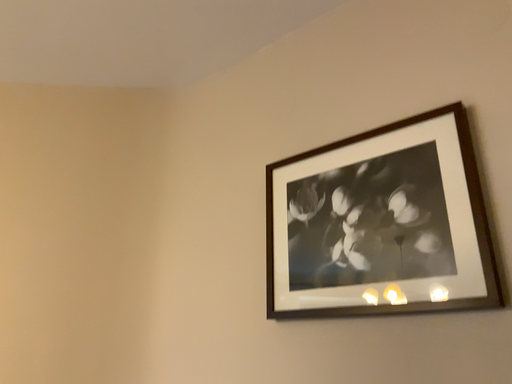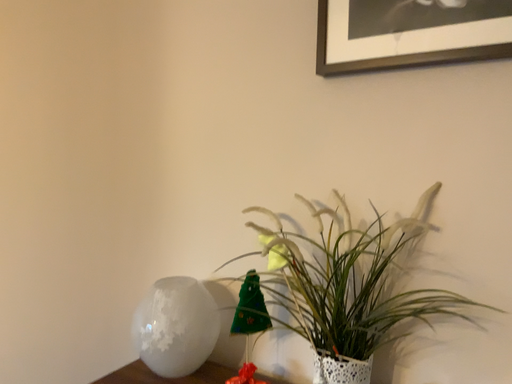
Question: How did the camera likely rotate when shooting the video?

Choices:
 (A) rotated downward
 (B) rotated upward

Answer: (A)